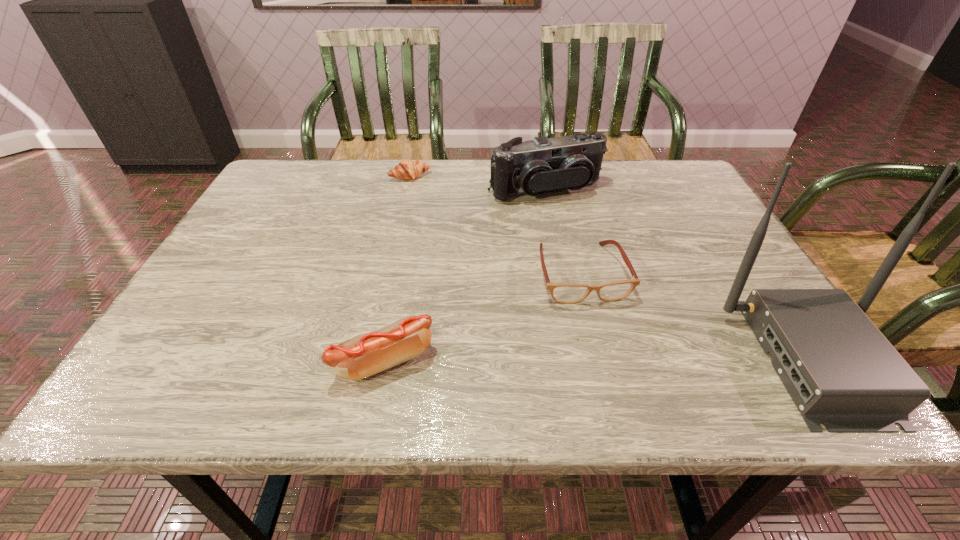
Where is `free area in between the tallest object and the fourth tallest object`? free area in between the tallest object and the fourth tallest object is located at coordinates (698, 316).

Image resolution: width=960 pixels, height=540 pixels. I want to click on free space between the sausage and the router, so click(x=599, y=360).

Locate an element on the screen. The height and width of the screenshot is (540, 960). vacant area that lies between the pastry and the third tallest object is located at coordinates (397, 268).

The height and width of the screenshot is (540, 960). In order to click on free space between the fourth tallest object and the camcorder in this screenshot , I will do `click(564, 232)`.

You are a GUI agent. You are given a task and a screenshot of the screen. Output one action in this format:
    pyautogui.click(x=<x>, y=<y>)
    Task: Click on the unoccupied area between the fourth shortest object and the spectacles
    
    Given the screenshot: What is the action you would take?
    pyautogui.click(x=564, y=232)

Image resolution: width=960 pixels, height=540 pixels. Find the location of `free space between the sausage and the spectacles`. free space between the sausage and the spectacles is located at coordinates 483,317.

Image resolution: width=960 pixels, height=540 pixels. Identify the location of object that is the third closest one to the rightmost object. (362, 356).

Find the location of `the third closest object to the fourth tallest object`. the third closest object to the fourth tallest object is located at coordinates (362, 356).

The width and height of the screenshot is (960, 540). I want to click on free space that satisfies the following two spatial constraints: 1. on the back side of the rightmost object; 2. on the back of the third tallest object to connect cables, so click(x=385, y=359).

Where is `free region that satisfies the following two spatial constraints: 1. on the front side of the sausage; 2. on the left side of the shortest object`? This screenshot has height=540, width=960. free region that satisfies the following two spatial constraints: 1. on the front side of the sausage; 2. on the left side of the shortest object is located at coordinates (370, 361).